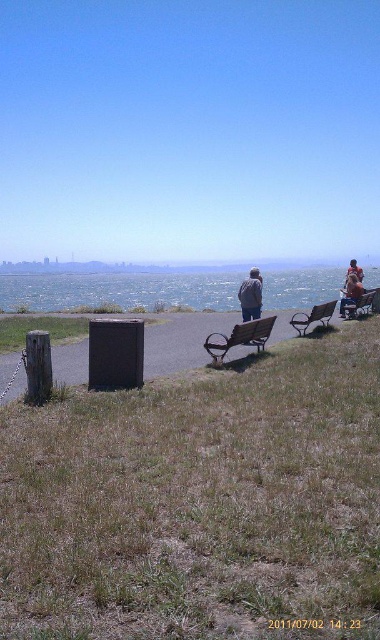
Which is below, blue water at center or wooden park bench at center?

wooden park bench at center is below.

From the picture: Can you confirm if blue water at center is positioned above wooden park bench at center?

Indeed, blue water at center is positioned over wooden park bench at center.

The height and width of the screenshot is (640, 380). Describe the element at coordinates (120, 291) in the screenshot. I see `blue water at center` at that location.

You are a GUI agent. You are given a task and a screenshot of the screen. Output one action in this format:
    pyautogui.click(x=<x>, y=<y>)
    Task: Click on the blue water at center
    The image size is (380, 640).
    Given the screenshot: What is the action you would take?
    pyautogui.click(x=120, y=291)

Is wooden park bench at center below wooden bench at center?

Correct, wooden park bench at center is located below wooden bench at center.

You are a GUI agent. You are given a task and a screenshot of the screen. Output one action in this format:
    pyautogui.click(x=<x>, y=<y>)
    Task: Click on the wooden park bench at center
    The width and height of the screenshot is (380, 640).
    Given the screenshot: What is the action you would take?
    pyautogui.click(x=313, y=316)

Where is `wooden park bench at center`? Image resolution: width=380 pixels, height=640 pixels. wooden park bench at center is located at coordinates click(313, 316).

The width and height of the screenshot is (380, 640). What are the coordinates of `denim jacket at center` in the screenshot? It's located at (251, 296).

Between denim jacket at center and wooden park bench at center, which one is positioned lower?

wooden park bench at center

Which is behind, point (248, 278) or point (323, 307)?

The point (323, 307) is behind.

I want to click on denim jacket at center, so click(x=251, y=296).